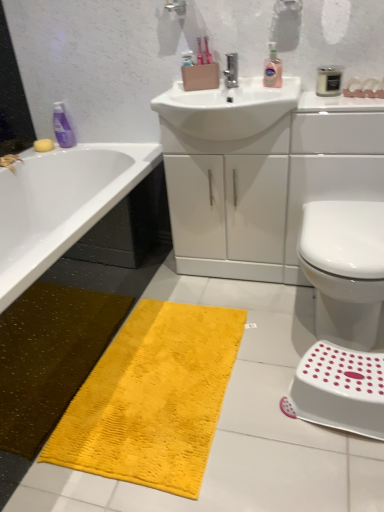
This screenshot has height=512, width=384. I want to click on free space to the right of yellow plush bath mat at lower center, so [278, 374].